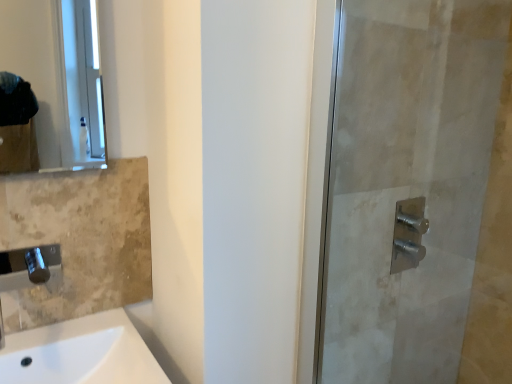
Question: Is white ceramic sink at lower left bigger or smaller than satin nickel faucet at right?

Choices:
 (A) big
 (B) small

Answer: (A)

Question: Do you think white ceramic sink at lower left is within satin nickel faucet at right, or outside of it?

Choices:
 (A) inside
 (B) outside

Answer: (B)

Question: Based on their relative distances, which object is farther from the satin nickel faucet at right?

Choices:
 (A) white ceramic sink at lower left
 (B) satin nickel shower handle at right
 (C) polished chrome faucet at lower left
 (D) matte glass mirror at upper left

Answer: (D)

Question: Based on their relative distances, which object is farther from the satin nickel shower handle at right?

Choices:
 (A) satin nickel faucet at right
 (B) white ceramic sink at lower left
 (C) matte glass mirror at upper left
 (D) polished chrome faucet at lower left

Answer: (C)